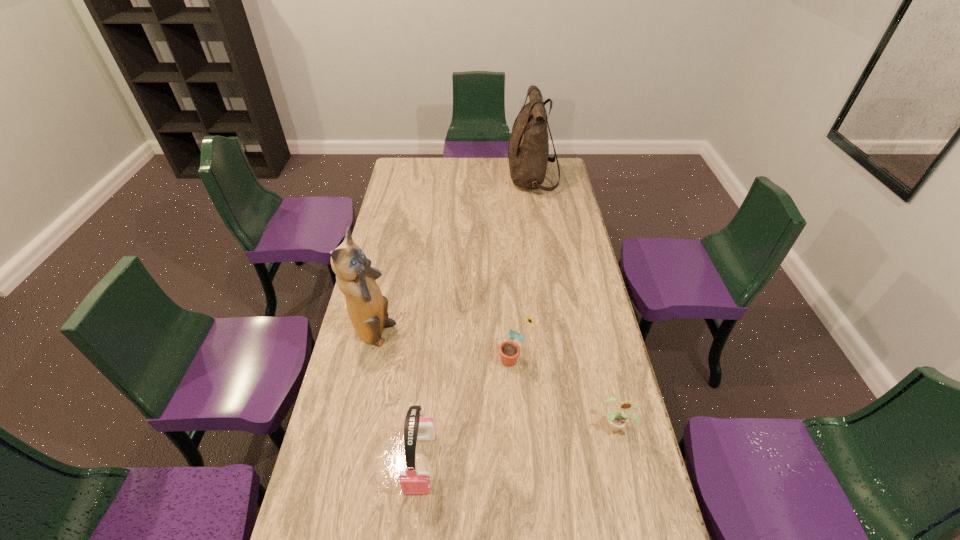
The image size is (960, 540). Identify the location of backpack. (528, 149).

Where is `cat`? This screenshot has height=540, width=960. cat is located at coordinates (367, 308).

Locate an element on the screen. The width and height of the screenshot is (960, 540). the taller sunflower is located at coordinates (509, 351).

Where is `the farther sunflower`? the farther sunflower is located at coordinates (509, 351).

Where is `earphone`? earphone is located at coordinates (417, 427).

Where is `the right sunflower`? The width and height of the screenshot is (960, 540). the right sunflower is located at coordinates (617, 419).

The height and width of the screenshot is (540, 960). In order to click on the nearer sunflower in this screenshot , I will do `click(617, 419)`.

In order to click on vacant space situated on the open flap of the farthest object in this screenshot , I will do [x=462, y=179].

This screenshot has height=540, width=960. I want to click on free space located on the open flap of the farthest object, so click(x=473, y=179).

Locate an element on the screen. vacant area situated on the open flap of the farthest object is located at coordinates (448, 179).